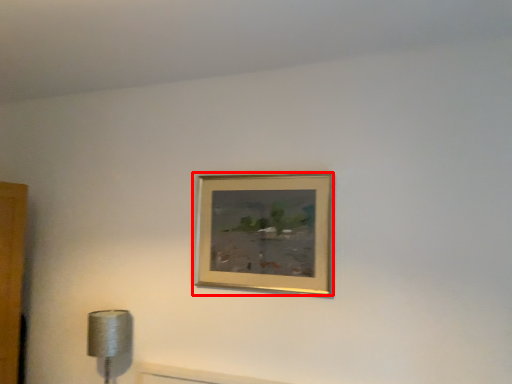
Question: From the image's perspective, where is picture frame (annotated by the red box) located in relation to lamp in the image?

Choices:
 (A) below
 (B) above

Answer: (B)